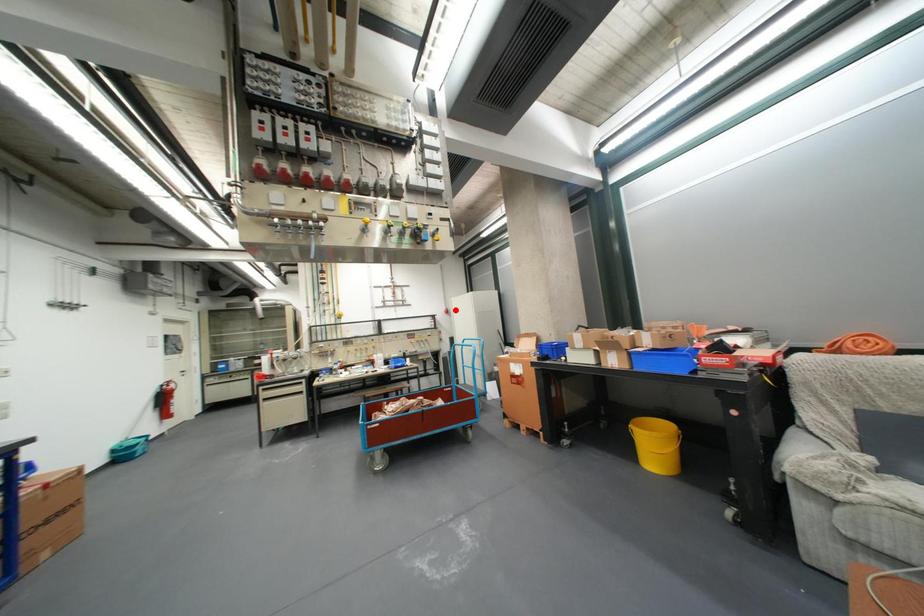
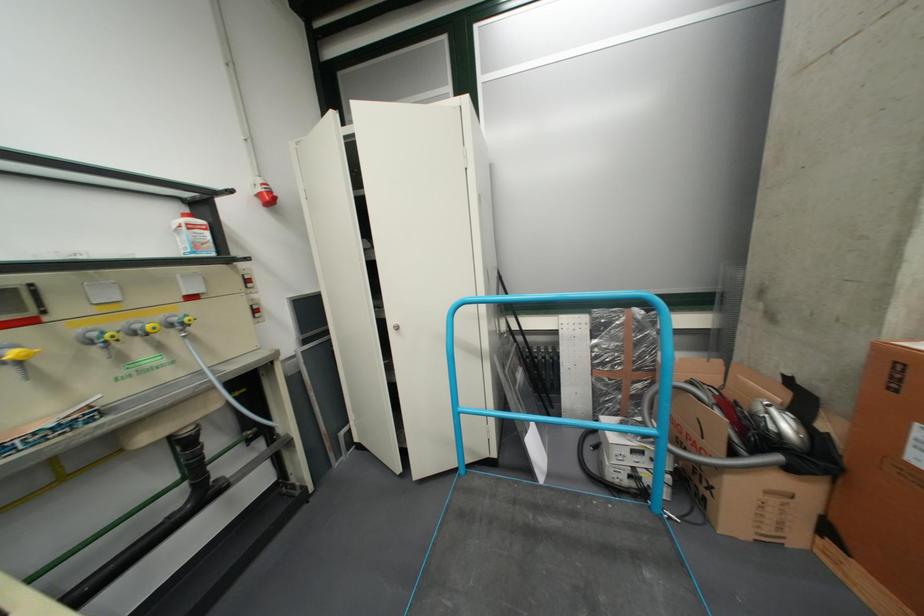
Where in the second image is the point corresponding to the highlighted location from the first image?

(260, 185)